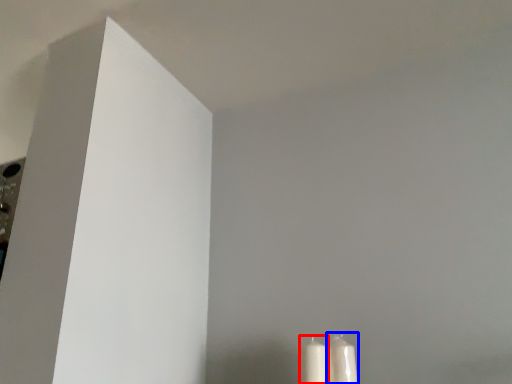
Question: Which object is closer to the camera taking this photo, candle (highlighted by a red box) or candle (highlighted by a blue box)?

Choices:
 (A) candle
 (B) candle

Answer: (A)